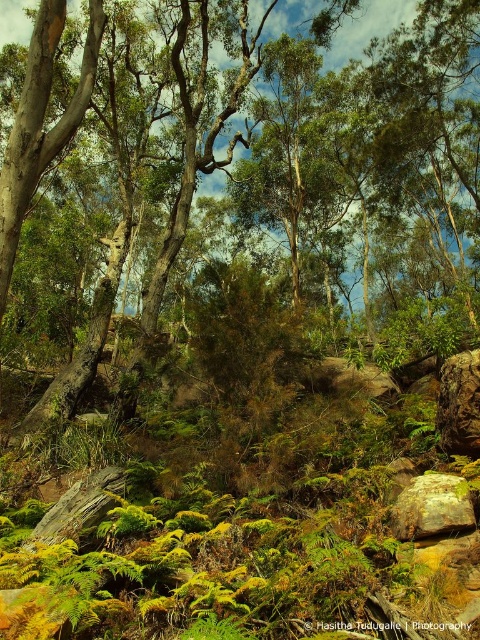
Is green leafy tree at center above rusty metallic rock at lower right?

Correct, green leafy tree at center is located above rusty metallic rock at lower right.

How distant is green leafy tree at center from rusty metallic rock at lower right?

green leafy tree at center and rusty metallic rock at lower right are 12.90 meters apart from each other.

Which is behind, point (183, 76) or point (433, 531)?

The point (183, 76) is more distant.

Find the location of `green leafy tree at center`. green leafy tree at center is located at coordinates (375, 125).